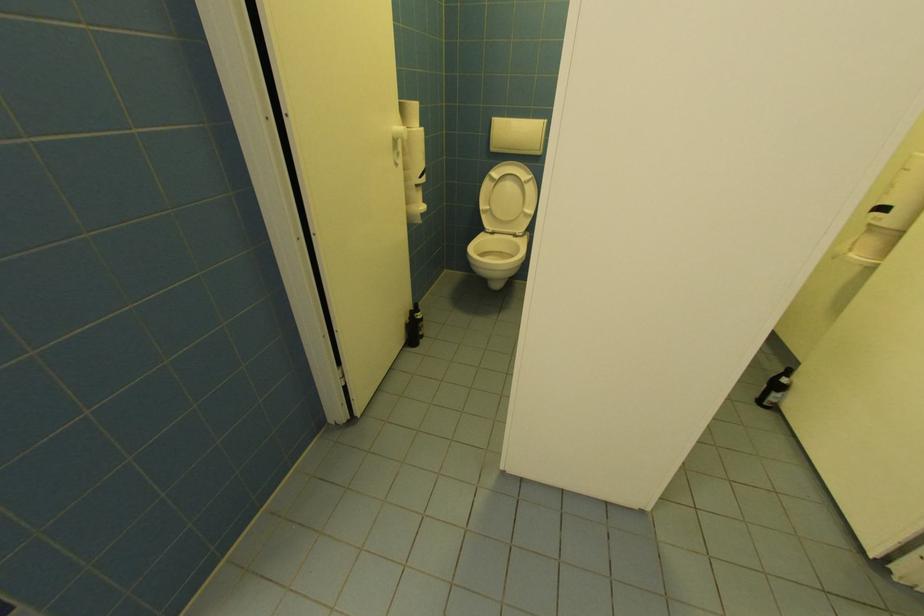
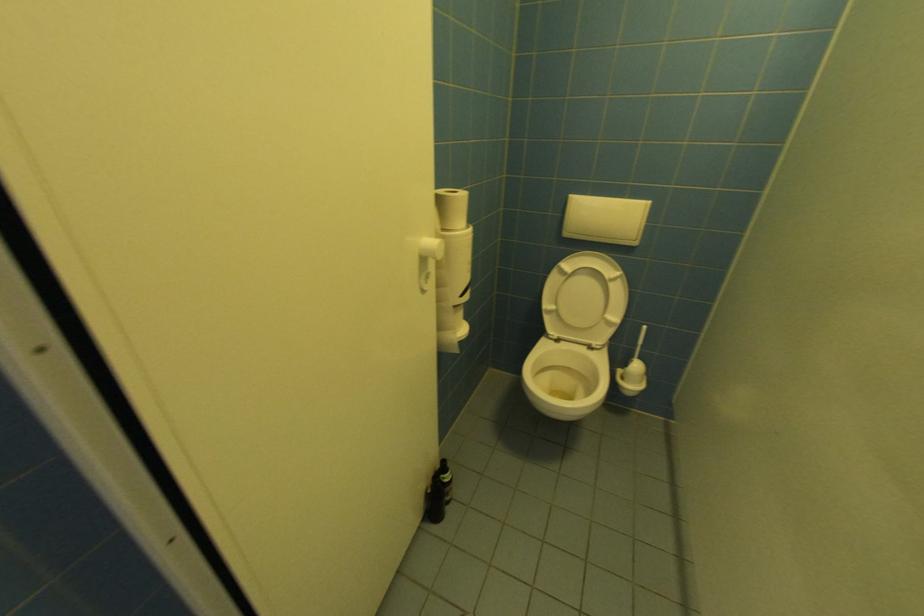
Question: The first image is from the beginning of the video and the second image is from the end. How did the camera likely rotate when shooting the video?

Choices:
 (A) Left
 (B) Right
 (C) Up
 (D) Down

Answer: (A)